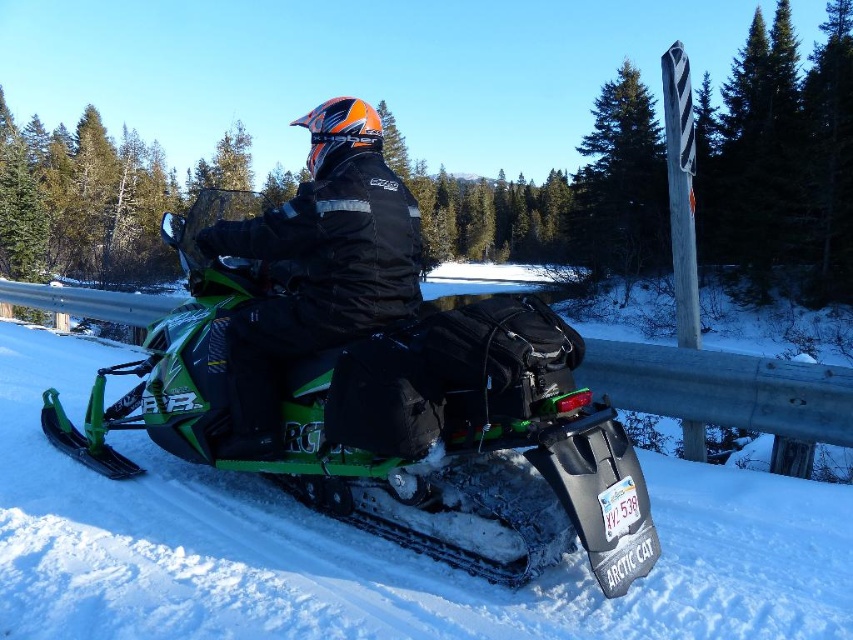
Measure the distance between green matte snowmobile at center and black matte jacket at center.

5.11 feet

Locate an element on the screen. This screenshot has width=853, height=640. green matte snowmobile at center is located at coordinates (395, 419).

You are a GUI agent. You are given a task and a screenshot of the screen. Output one action in this format:
    pyautogui.click(x=<x>, y=<y>)
    Task: Click on the green matte snowmobile at center
    
    Given the screenshot: What is the action you would take?
    pyautogui.click(x=395, y=419)